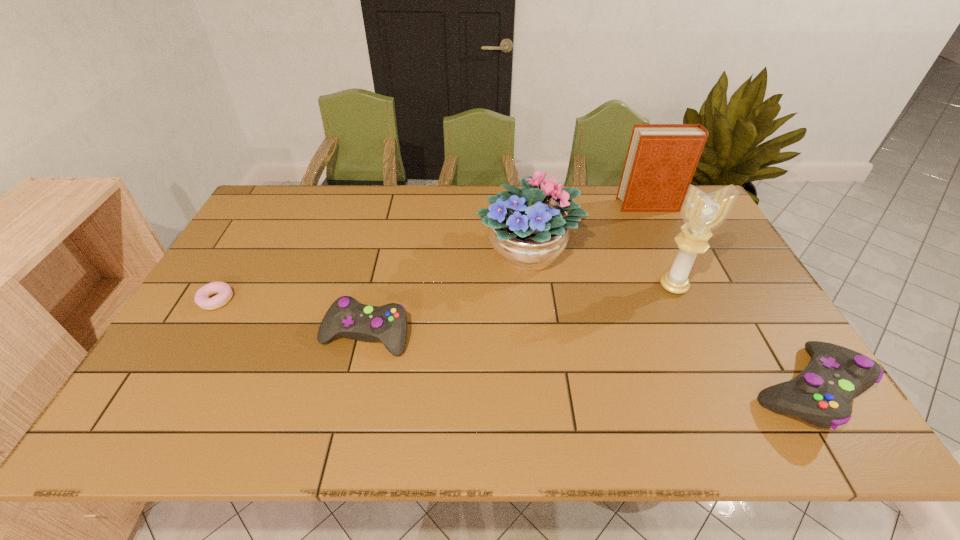
Find the location of a particular element. Image resolution: width=960 pixels, height=540 pixels. the fifth object from right to left is located at coordinates (346, 316).

Locate an element on the screen. The height and width of the screenshot is (540, 960). the shorter control is located at coordinates (346, 316).

This screenshot has width=960, height=540. What are the coordinates of `the right control` in the screenshot? It's located at tap(821, 395).

Image resolution: width=960 pixels, height=540 pixels. Find the location of `the taller control`. the taller control is located at coordinates (821, 395).

Find the location of a particular element. The width and height of the screenshot is (960, 540). hardback book is located at coordinates (661, 160).

I want to click on the third object from left to right, so click(528, 227).

Locate an element on the screen. This screenshot has height=540, width=960. doughnut is located at coordinates (223, 290).

The height and width of the screenshot is (540, 960). Find the location of `the shortest object`. the shortest object is located at coordinates (223, 290).

Find the location of `award`. award is located at coordinates (702, 213).

Locate an element on the screen. Image resolution: width=960 pixels, height=540 pixels. vacant space located 0.340m on the back of the fifth object from right to left is located at coordinates (390, 233).